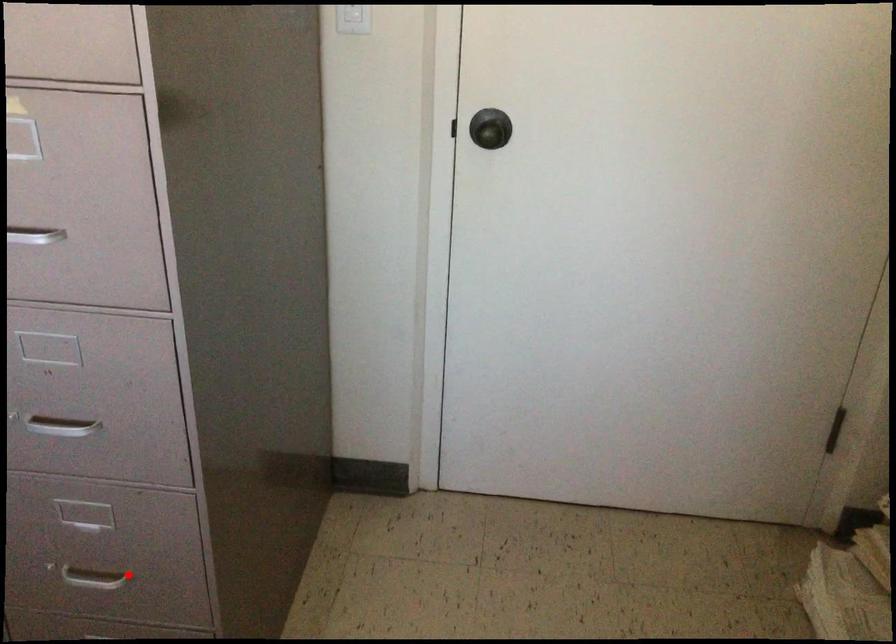
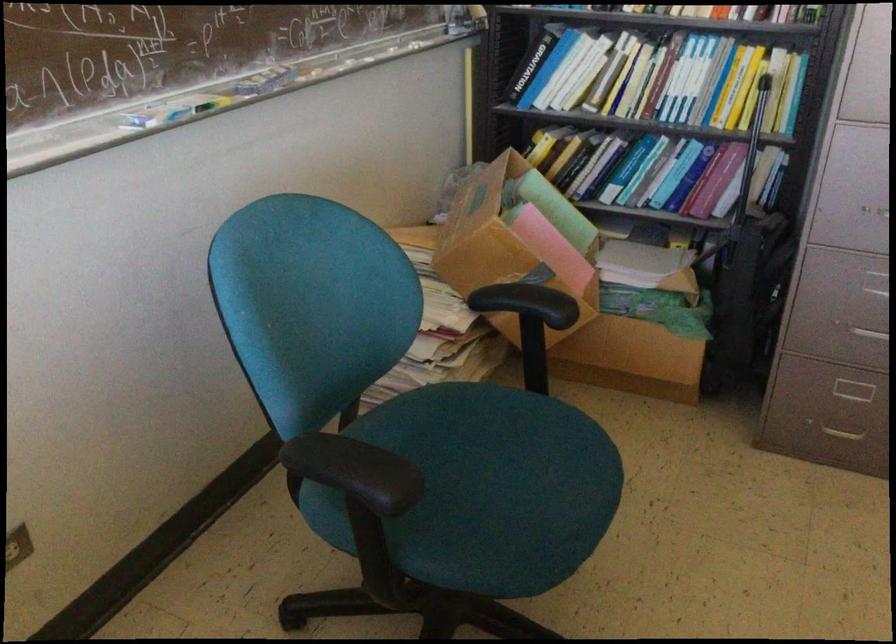
The point at the highlighted location is marked in the first image. Where is the corresponding point in the second image?

(869, 330)